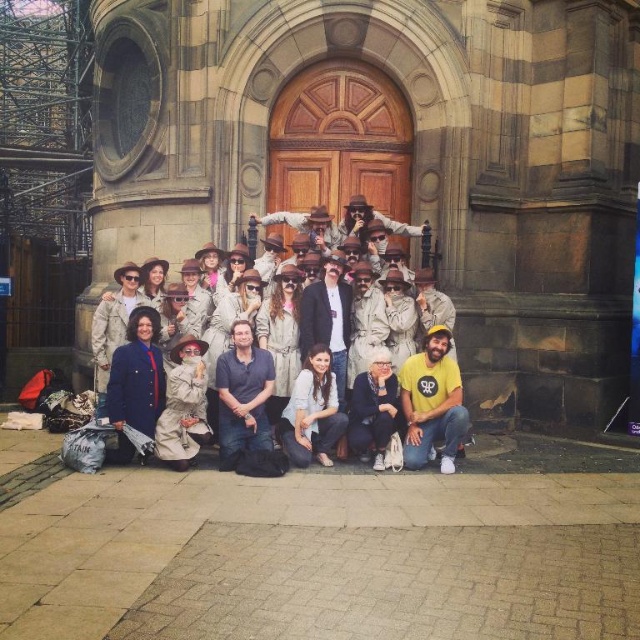
Can you confirm if dark blue shirt at center is wider than smooth beige coat at center?

Correct, the width of dark blue shirt at center exceeds that of smooth beige coat at center.

Who is more distant from viewer, (x=241, y=390) or (x=300, y=298)?

Positioned behind is point (x=300, y=298).

This screenshot has height=640, width=640. Find the location of `dark blue shirt at center`. dark blue shirt at center is located at coordinates (243, 396).

Can you confirm if yellow cotton t-shirt at lower center is positioned above dark blue shirt at center?

Yes.

Between yellow cotton t-shirt at lower center and dark blue shirt at center, which one appears on the right side from the viewer's perspective?

Positioned to the right is yellow cotton t-shirt at lower center.

Locate an element on the screen. The width and height of the screenshot is (640, 640). yellow cotton t-shirt at lower center is located at coordinates (433, 403).

Is point (220, 328) less distant than point (234, 368)?

No, (220, 328) is behind (234, 368).

Does beige trench coat at center come in front of dark blue shirt at center?

No, beige trench coat at center is behind dark blue shirt at center.

Who is more distant from viewer, (289, 360) or (227, 467)?

The point (289, 360) is more distant.

Identify the location of beige trench coat at center. Image resolution: width=640 pixels, height=640 pixels. (172, 301).